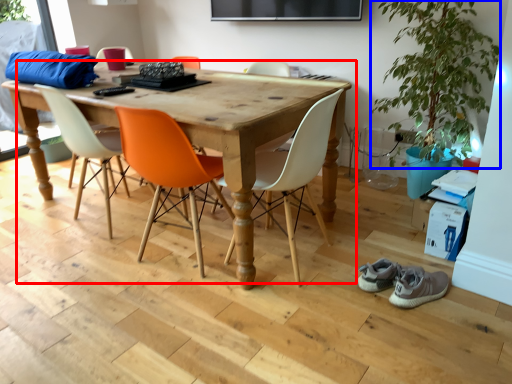
Question: Which of the following is the farthest to the observer, kitchen & dining room table (highlighted by a red box) or plant (highlighted by a blue box)?

Choices:
 (A) kitchen & dining room table
 (B) plant

Answer: (B)